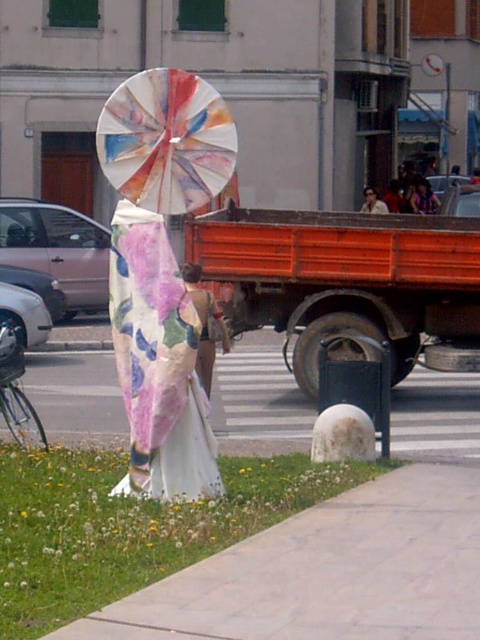
Question: Which of the following is the farthest from the observer?

Choices:
 (A) (131, 289)
 (B) (141, 92)

Answer: (A)

Question: Can you confirm if floral silk dress at center is wider than painted paper umbrella at center?

Choices:
 (A) no
 (B) yes

Answer: (B)

Question: Among these points, which one is farthest from the camera?

Choices:
 (A) pos(224,340)
 (B) pos(159,77)
 (C) pos(422,188)
 (D) pos(196,420)

Answer: (C)

Question: Does floral silk dress at center have a greater width compared to matte pink dress at upper right?

Choices:
 (A) no
 (B) yes

Answer: (A)

Question: Is painted paper umbrella at center to the left of matte pink dress at upper right from the viewer's perspective?

Choices:
 (A) yes
 (B) no

Answer: (A)

Question: Which object appears closest to the camera in this image?

Choices:
 (A) matte floral dress at center
 (B) floral silk dress at center
 (C) matte pink dress at upper right
 (D) white stone pavement at lower right

Answer: (D)